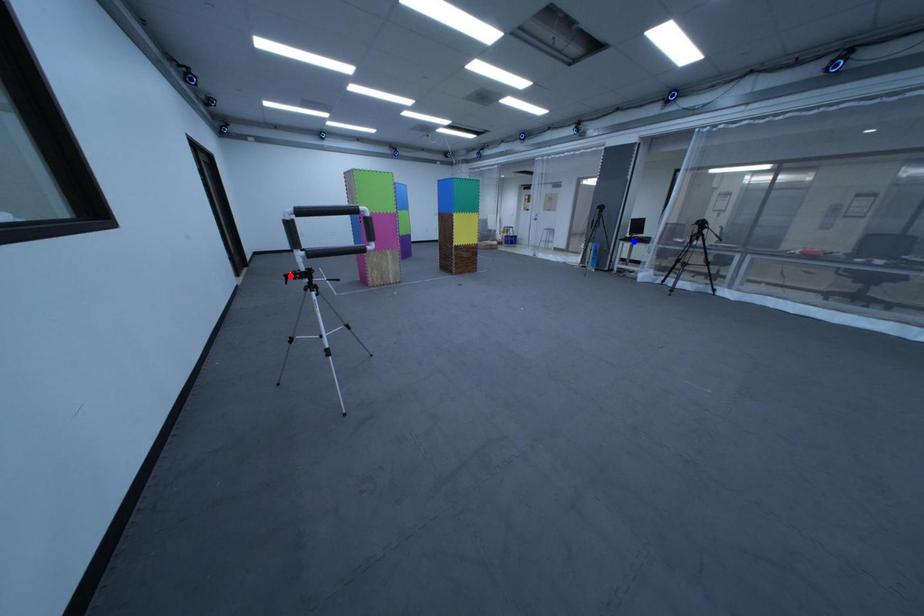
Question: In the image, two points are highlighted. Which point is nearer to the camera? Reply with the corresponding letter.

Choices:
 (A) blue point
 (B) red point

Answer: (B)